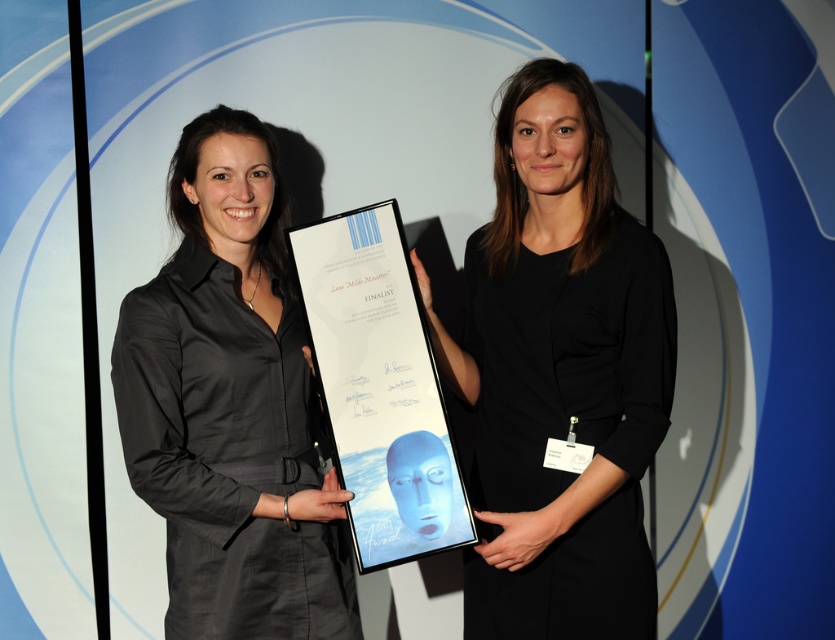
Is black matte dress at center thinner than matte black dress at center?

No.

Is black matte dress at center closer to the viewer compared to matte black dress at center?

Yes, it is.

Who is more distant from viewer, (x=499, y=429) or (x=193, y=380)?

Positioned behind is point (x=499, y=429).

In order to click on black matte dress at center in this screenshot , I will do (x=559, y=374).

Measure the distance between black matte dress at center and camera.

black matte dress at center and camera are 4.97 feet apart.

Is black matte dress at center thinner than white glossy plaque at center?

In fact, black matte dress at center might be wider than white glossy plaque at center.

What do you see at coordinates (559, 374) in the screenshot?
I see `black matte dress at center` at bounding box center [559, 374].

Identify the location of black matte dress at center. (559, 374).

Describe the element at coordinates (231, 404) in the screenshot. I see `matte black dress at center` at that location.

Which is in front, point (225, 451) or point (418, 496)?

Point (418, 496)

Is point (215, 230) farther from camera compared to point (372, 260)?

Yes, point (215, 230) is behind point (372, 260).

Identify the location of matte black dress at center. (231, 404).